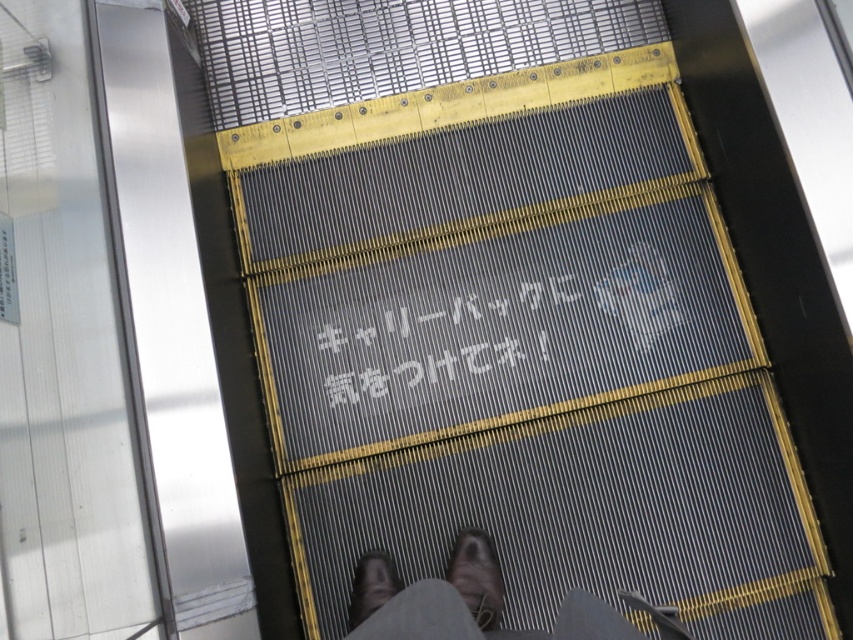
You are standing on the escalator and see two shoes on the steps. Which shoe is positioned to the right side? Please choose between dark brown leather shoes at center and brown leather shoe at center.

The dark brown leather shoes at center is positioned to the right of the brown leather shoe at center.